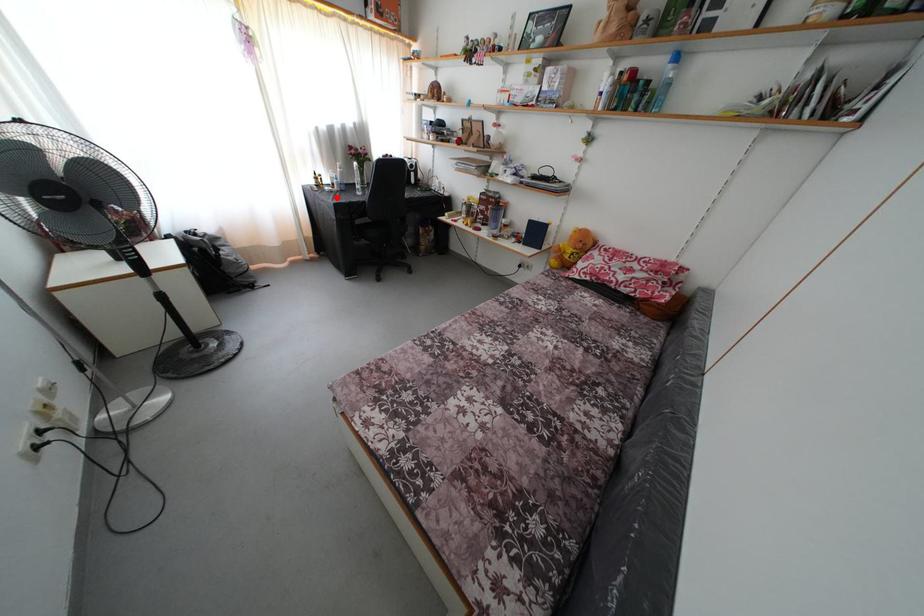
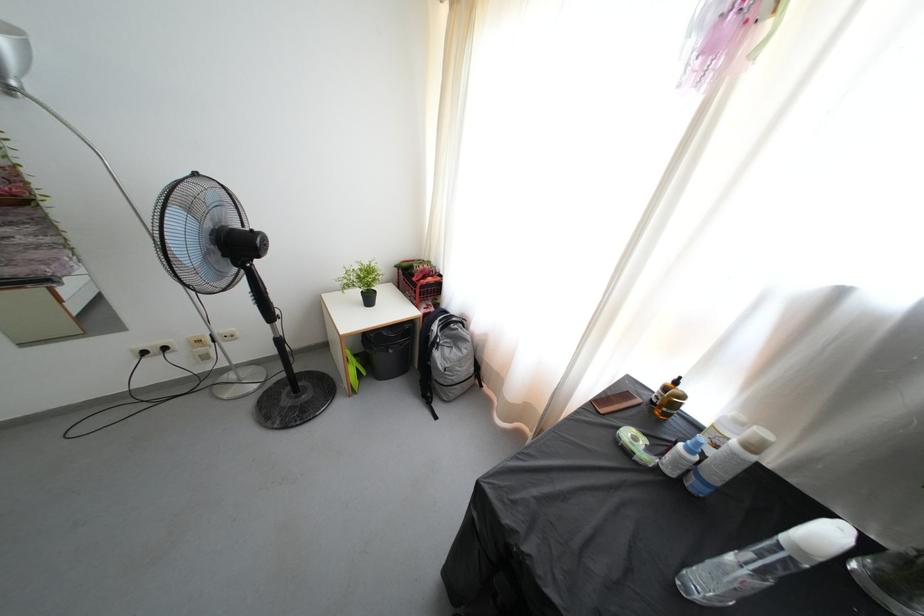
The point at the highlighted location is marked in the first image. Where is the corresponding point in the second image?

(631, 458)